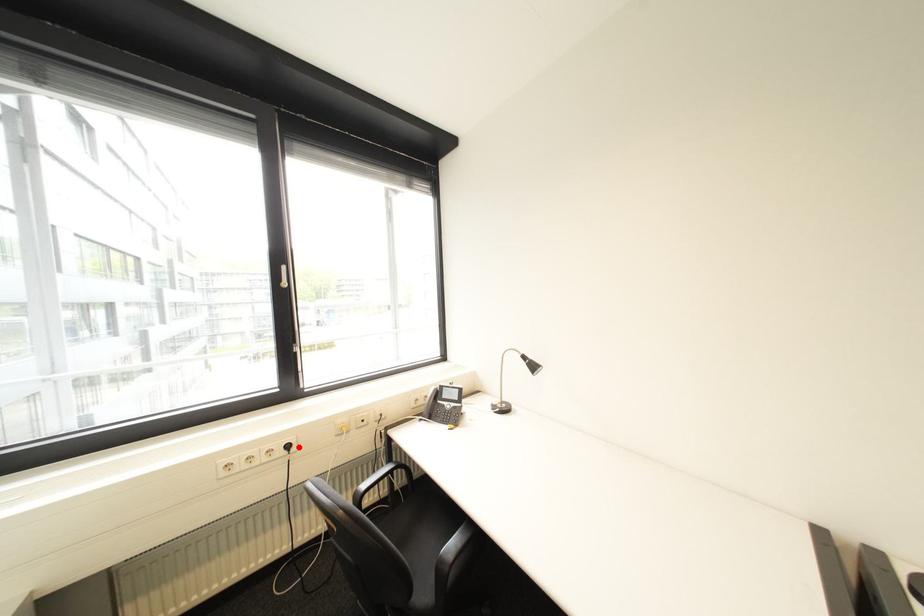
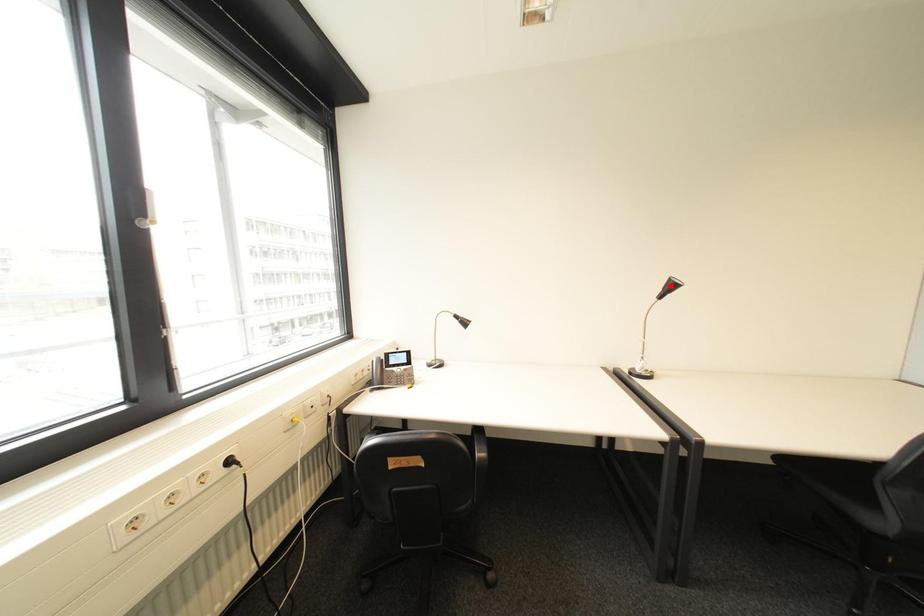
I am providing you with two images of the same scene from different viewpoints. A red point is marked on the first image and another point is marked on the second image. Is the red point in image1 aligned with the point shown in image2?

No